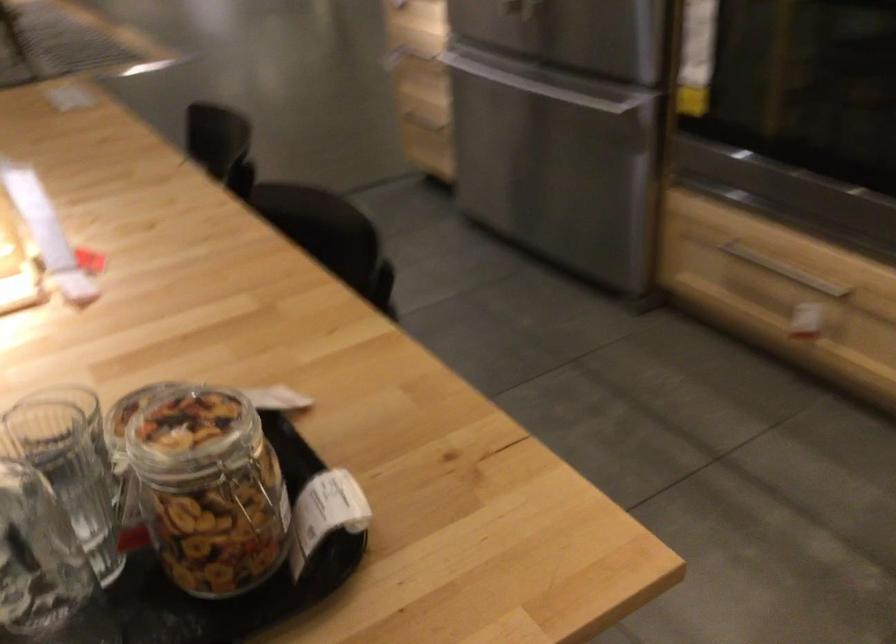
At what (x,y) coordinates should I click in order to perform the action: click on jar metal clasp. Please return your answer as a coordinate pair (x, y). Looking at the image, I should click on (250, 493).